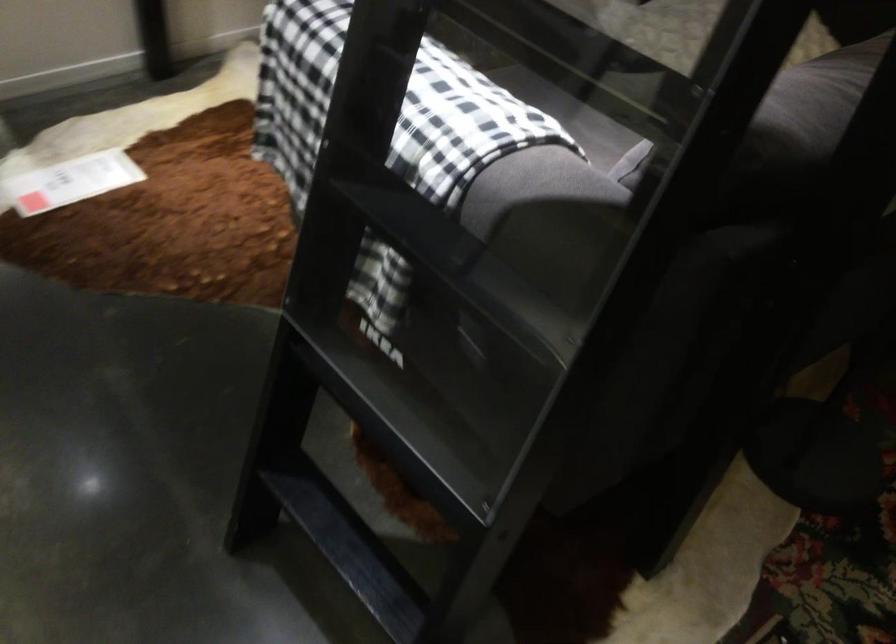
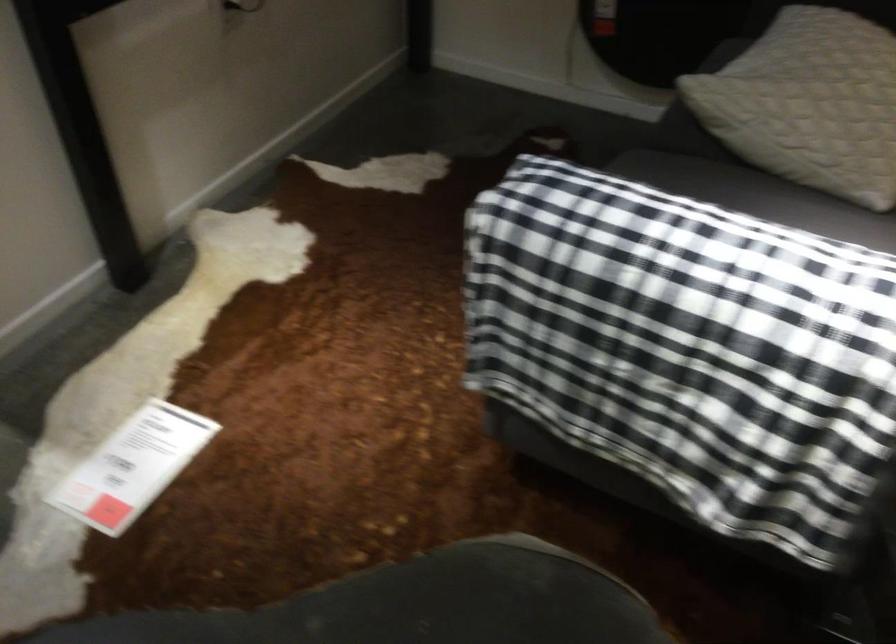
In a continuous first-person perspective shot, in which direction is the camera moving?

The cameraman moved toward left, forward.